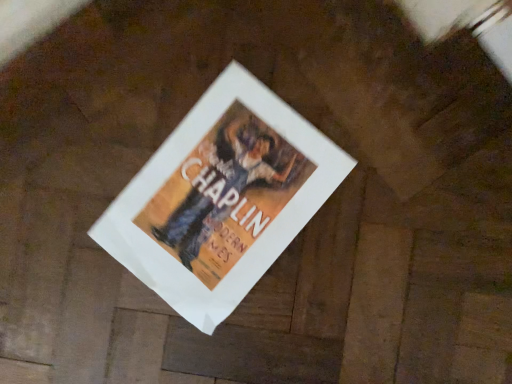
The height and width of the screenshot is (384, 512). Describe the element at coordinates (221, 198) in the screenshot. I see `white paper at center` at that location.

Image resolution: width=512 pixels, height=384 pixels. Find the location of `white paper at center`. white paper at center is located at coordinates (221, 198).

Locate an element on the screen. white paper at center is located at coordinates (221, 198).